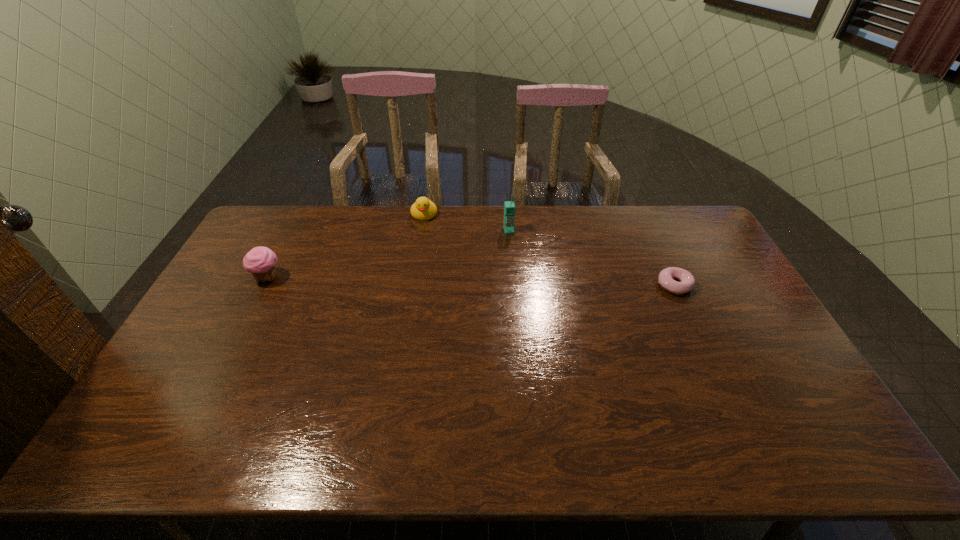
In the image, there is a desktop. Identify the location of free space at the far edge. (450, 237).

Where is `vacant area at the near edge`? vacant area at the near edge is located at coordinates (491, 406).

Where is `vacant space at the right edge`? The width and height of the screenshot is (960, 540). vacant space at the right edge is located at coordinates (710, 254).

In order to click on vacant space at the far left corner in this screenshot , I will do `click(290, 222)`.

In the image, there is a desktop. At what (x,y) coordinates should I click in order to perform the action: click on blank space at the far right corner. Please return your answer as a coordinate pair (x, y). Image resolution: width=960 pixels, height=540 pixels. Looking at the image, I should click on (657, 206).

Find the location of a particular element. vacant space in between the second object from left to right and the shortest object is located at coordinates (549, 249).

Find the location of a particular element. This screenshot has width=960, height=540. empty space that is in between the duckling and the doughnut is located at coordinates (549, 249).

This screenshot has height=540, width=960. I want to click on vacant area that lies between the leftmost object and the third object from right to left, so click(x=346, y=246).

The height and width of the screenshot is (540, 960). In order to click on free space between the third nearest object and the third shortest object in this screenshot , I will do `click(388, 254)`.

Identify the location of empty space between the second object from left to right and the doughnut. The image size is (960, 540). (549, 249).